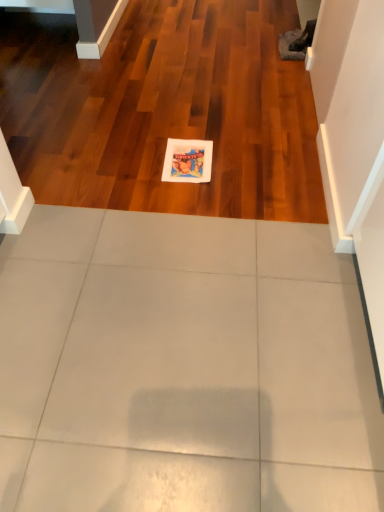
Question: Is white glossy tile at center at the right side of matte paper postcard at center?

Choices:
 (A) no
 (B) yes

Answer: (A)

Question: Is white glossy tile at center thinner than matte paper postcard at center?

Choices:
 (A) yes
 (B) no

Answer: (B)

Question: From the image's perspective, is white glossy tile at center on top of matte paper postcard at center?

Choices:
 (A) yes
 (B) no

Answer: (A)

Question: Is white glossy tile at center wider than matte paper postcard at center?

Choices:
 (A) no
 (B) yes

Answer: (B)

Question: Is white glossy tile at center behind matte paper postcard at center?

Choices:
 (A) yes
 (B) no

Answer: (B)

Question: Can you confirm if white glossy tile at center is bigger than matte paper postcard at center?

Choices:
 (A) yes
 (B) no

Answer: (A)

Question: Considering the relative positions of matte paper postcard at center and white glossy tile at center in the image provided, is matte paper postcard at center behind white glossy tile at center?

Choices:
 (A) no
 (B) yes

Answer: (B)

Question: Would you consider matte paper postcard at center to be distant from white glossy tile at center?

Choices:
 (A) yes
 (B) no

Answer: (B)

Question: Does matte paper postcard at center have a larger size compared to white glossy tile at center?

Choices:
 (A) no
 (B) yes

Answer: (A)

Question: Can you confirm if matte paper postcard at center is wider than white glossy tile at center?

Choices:
 (A) yes
 (B) no

Answer: (B)

Question: Does matte paper postcard at center lie in front of white glossy tile at center?

Choices:
 (A) no
 (B) yes

Answer: (A)

Question: Can you confirm if matte paper postcard at center is thinner than white glossy tile at center?

Choices:
 (A) yes
 (B) no

Answer: (A)

Question: Based on their sizes in the image, would you say white glossy tile at center is bigger or smaller than matte paper postcard at center?

Choices:
 (A) big
 (B) small

Answer: (A)